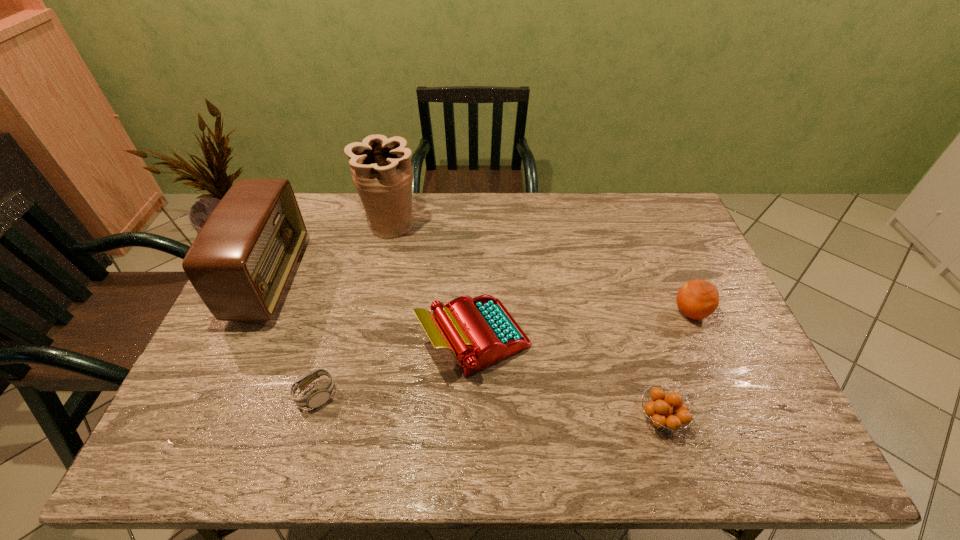
Identify the location of urn. Image resolution: width=960 pixels, height=540 pixels. (381, 169).

Find the location of a particular element. The width and height of the screenshot is (960, 540). the leftmost object is located at coordinates (240, 263).

Image resolution: width=960 pixels, height=540 pixels. I want to click on the third tallest object, so click(x=479, y=331).

At what (x,y) coordinates should I click in order to perform the action: click on the third object from right to left. Please return your answer as a coordinate pair (x, y). Looking at the image, I should click on (479, 331).

Identify the location of the fourth tallest object. (697, 299).

This screenshot has width=960, height=540. Find the location of `the right orange fruit`. the right orange fruit is located at coordinates (697, 299).

Find the location of `the shorter orange fruit`. the shorter orange fruit is located at coordinates (662, 415).

Where is `the nearer orange fruit`? Image resolution: width=960 pixels, height=540 pixels. the nearer orange fruit is located at coordinates (662, 415).

Where is `the shortest object`? the shortest object is located at coordinates (317, 397).

The width and height of the screenshot is (960, 540). In order to click on vacant position located 0.290m on the front of the urn in this screenshot , I will do `click(372, 310)`.